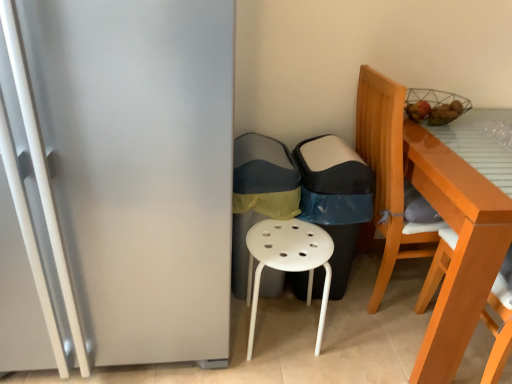
Question: Considering the relative sizes of white plastic stool at center and black plastic trash can at center, the 1th garbage when ordered from right to left, in the image provided, is white plastic stool at center thinner than black plastic trash can at center, the 1th garbage when ordered from right to left,?

Choices:
 (A) no
 (B) yes

Answer: (B)

Question: Is black plastic trash can at center, the second garbage viewed from the left, located within white plastic stool at center?

Choices:
 (A) yes
 (B) no

Answer: (B)

Question: Considering the relative sizes of white plastic stool at center and black plastic trash can at center, the 1th garbage when ordered from right to left, in the image provided, is white plastic stool at center wider than black plastic trash can at center, the 1th garbage when ordered from right to left,?

Choices:
 (A) yes
 (B) no

Answer: (B)

Question: From the image's perspective, is white plastic stool at center above black plastic trash can at center, the 1th garbage when ordered from right to left?

Choices:
 (A) yes
 (B) no

Answer: (B)

Question: Is white plastic stool at center positioned with its back to black plastic trash can at center, the second garbage viewed from the left?

Choices:
 (A) yes
 (B) no

Answer: (A)

Question: Is white plastic stool at center positioned in front of black plastic trash can at center, the second garbage viewed from the left?

Choices:
 (A) no
 (B) yes

Answer: (B)

Question: Can you confirm if light brown wooden chair at right, the 2th chair in the left-to-right sequence, is smaller than black plastic trash can at center, the second garbage viewed from the left?

Choices:
 (A) yes
 (B) no

Answer: (B)

Question: Can you confirm if light brown wooden chair at right, the 2th chair in the left-to-right sequence, is positioned to the right of black plastic trash can at center, the second garbage viewed from the left?

Choices:
 (A) no
 (B) yes

Answer: (B)

Question: From a real-world perspective, is light brown wooden chair at right, the 1th chair in the right-to-left sequence, positioned under black plastic trash can at center, the second garbage viewed from the left, based on gravity?

Choices:
 (A) yes
 (B) no

Answer: (B)

Question: From the image's perspective, is light brown wooden chair at right, the 1th chair in the right-to-left sequence, below black plastic trash can at center, the 1th garbage when ordered from right to left?

Choices:
 (A) yes
 (B) no

Answer: (A)

Question: Considering the relative sizes of light brown wooden chair at right, the 1th chair in the right-to-left sequence, and black plastic trash can at center, the second garbage viewed from the left, in the image provided, is light brown wooden chair at right, the 1th chair in the right-to-left sequence, taller than black plastic trash can at center, the second garbage viewed from the left,?

Choices:
 (A) no
 (B) yes

Answer: (B)

Question: Is black plastic trash can at center, the second garbage viewed from the left, at the back of light brown wooden chair at right, the 1th chair in the right-to-left sequence?

Choices:
 (A) yes
 (B) no

Answer: (B)

Question: Is gray fabric trash can at center, positioned as the first garbage in left-to-right order, positioned with its back to satin silver fridge at left?

Choices:
 (A) no
 (B) yes

Answer: (A)